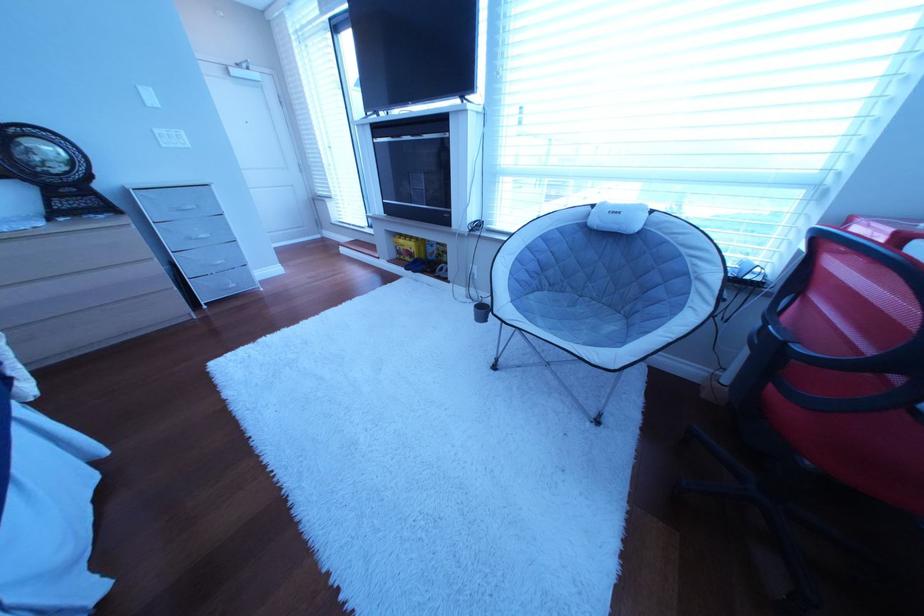
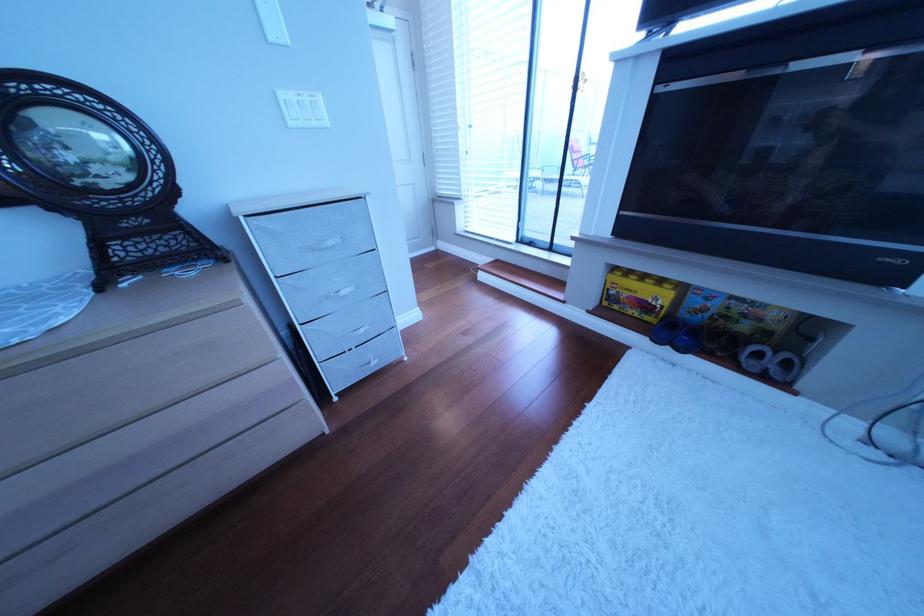
Locate, in the second image, the point that corresponds to point 418,251 in the first image.

(640, 296)